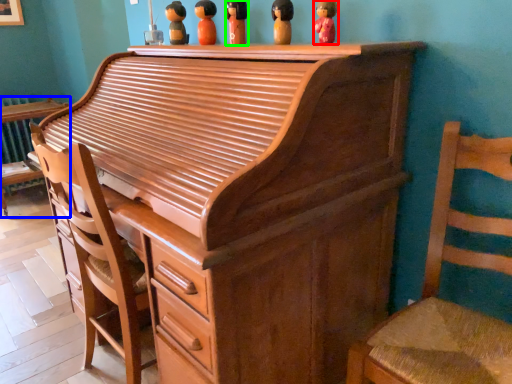
Question: Which object is the closest to the toy (highlighted by a red box)? Choose among these: furniture (highlighted by a blue box) or toy (highlighted by a green box).

Choices:
 (A) furniture
 (B) toy

Answer: (B)